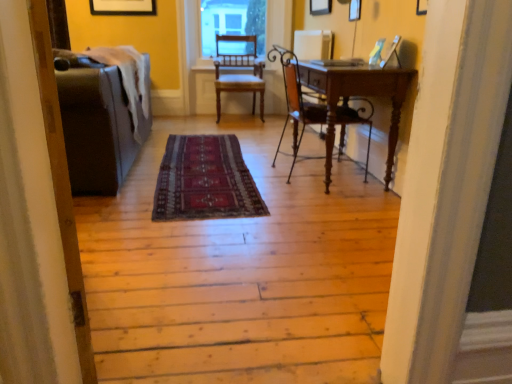
The width and height of the screenshot is (512, 384). In order to click on vacant space in front of wooden chair at center, the first chair from the left in this screenshot , I will do [x=240, y=122].